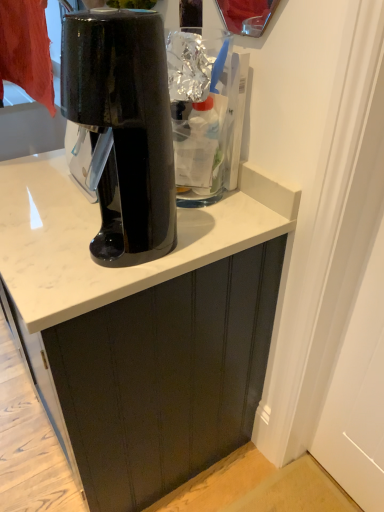
Image resolution: width=384 pixels, height=512 pixels. What are the coordinates of `glossy black coffee maker at center` in the screenshot? It's located at (121, 130).

Describe the element at coordinates (121, 130) in the screenshot. Image resolution: width=384 pixels, height=512 pixels. I see `glossy black coffee maker at center` at that location.

Locate an element on the screen. The width and height of the screenshot is (384, 512). matte black cabinet at center is located at coordinates (143, 328).

Describe the element at coordinates (143, 328) in the screenshot. I see `matte black cabinet at center` at that location.

This screenshot has width=384, height=512. I want to click on glossy black coffee maker at center, so click(x=121, y=130).

Can you confirm if matte black cabinet at center is positioned to the right of glossy black coffee maker at center?

No, matte black cabinet at center is not to the right of glossy black coffee maker at center.

Which object is closer to the camera taking this photo, matte black cabinet at center or glossy black coffee maker at center?

glossy black coffee maker at center is closer to the camera.

Is point (1, 177) closer to viewer compared to point (126, 173)?

No, it is not.

From the image's perspective, would you say matte black cabinet at center is positioned over glossy black coffee maker at center?

No, from the image's perspective, matte black cabinet at center is not on top of glossy black coffee maker at center.

From a real-world perspective, is matte black cabinet at center under glossy black coffee maker at center?

Indeed, from a real-world perspective, matte black cabinet at center is positioned beneath glossy black coffee maker at center.

Is matte black cabinet at center wider than glossy black coffee maker at center?

Yes.

Does matte black cabinet at center have a greater height compared to glossy black coffee maker at center?

Incorrect, the height of matte black cabinet at center is not larger of that of glossy black coffee maker at center.

From the picture: Considering the sizes of objects matte black cabinet at center and glossy black coffee maker at center in the image provided, who is bigger, matte black cabinet at center or glossy black coffee maker at center?

matte black cabinet at center.

Is glossy black coffee maker at center completely or partially inside matte black cabinet at center?

No, glossy black coffee maker at center is not inside matte black cabinet at center.

Are matte black cabinet at center and glossy black coffee maker at center located far from each other?

That's not correct — matte black cabinet at center is a little close to glossy black coffee maker at center.

Could you tell me if matte black cabinet at center is turned towards glossy black coffee maker at center?

No, matte black cabinet at center is not facing towards glossy black coffee maker at center.

Measure the distance from matte black cabinet at center to glossy black coffee maker at center.

A distance of 11.79 inches exists between matte black cabinet at center and glossy black coffee maker at center.

In order to click on home appliance in front of the matte black cabinet at center in this screenshot , I will do `click(121, 130)`.

From the picture: In the image, is glossy black coffee maker at center on the left side or the right side of matte black cabinet at center?

glossy black coffee maker at center is positioned on matte black cabinet at center's right side.

In the scene shown: Between glossy black coffee maker at center and matte black cabinet at center, which one is positioned in front?

glossy black coffee maker at center.

Considering the positions of point (86, 184) and point (246, 392), is point (86, 184) closer or farther from the camera than point (246, 392)?

Clearly, point (86, 184) is closer to the camera than point (246, 392).

From the image's perspective, which is below, glossy black coffee maker at center or matte black cabinet at center?

matte black cabinet at center appears lower in the image.

From a real-world perspective, between glossy black coffee maker at center and matte black cabinet at center, who is vertically lower?

From a 3D spatial view, matte black cabinet at center is below.

Does glossy black coffee maker at center have a greater width compared to matte black cabinet at center?

In fact, glossy black coffee maker at center might be narrower than matte black cabinet at center.

From their relative heights in the image, would you say glossy black coffee maker at center is taller or shorter than matte black cabinet at center?

glossy black coffee maker at center is taller than matte black cabinet at center.

Between glossy black coffee maker at center and matte black cabinet at center, which one has larger size?

Bigger between the two is matte black cabinet at center.

Is glossy black coffee maker at center positioned beyond the bounds of matte black cabinet at center?

Yes, glossy black coffee maker at center is outside of matte black cabinet at center.

Is glossy black coffee maker at center far from matte black cabinet at center?

No, there isn't a large distance between glossy black coffee maker at center and matte black cabinet at center.

Is glossy black coffee maker at center oriented towards matte black cabinet at center?

No, glossy black coffee maker at center is not turned towards matte black cabinet at center.

From the picture: How many degrees apart are the facing directions of glossy black coffee maker at center and matte black cabinet at center?

They differ by 0.167 degrees in their facing directions.

The height and width of the screenshot is (512, 384). In order to click on home appliance above the matte black cabinet at center (from the image's perspective) in this screenshot , I will do `click(121, 130)`.

You are a GUI agent. You are given a task and a screenshot of the screen. Output one action in this format:
    pyautogui.click(x=<x>, y=<y>)
    Task: Click on the home appliance above the matte black cabinet at center (from a real-world perspective)
    
    Given the screenshot: What is the action you would take?
    pyautogui.click(x=121, y=130)

Locate an element on the screen. This screenshot has height=512, width=384. cabinetry below the glossy black coffee maker at center (from the image's perspective) is located at coordinates (143, 328).